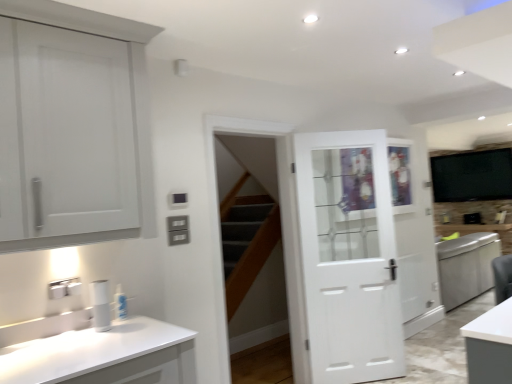
The image size is (512, 384). What do you see at coordinates (342, 259) in the screenshot?
I see `white matte door at center` at bounding box center [342, 259].

What are the coordinates of `white matte door at center` in the screenshot? It's located at 342,259.

Identify the location of white matte door at center. The width and height of the screenshot is (512, 384). [x=342, y=259].